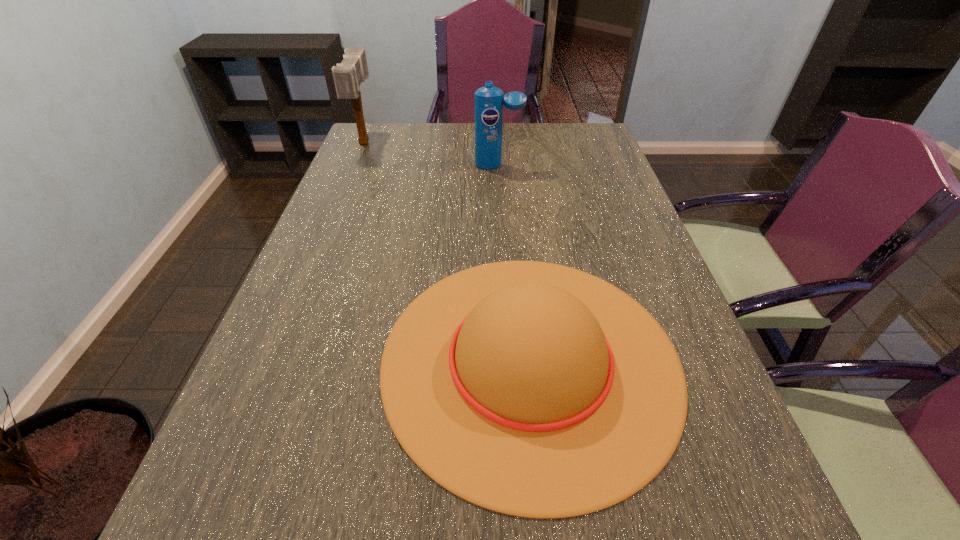
Locate an element on the screen. The height and width of the screenshot is (540, 960). object at the right edge is located at coordinates (532, 389).

Locate an element on the screen. object that is at the far left corner is located at coordinates (348, 75).

Identify the location of blank space at the left edge of the desktop. (277, 320).

What are the coordinates of `free space at the right edge of the desktop` in the screenshot? It's located at (717, 467).

Where is `vacant point at the far left corner`? vacant point at the far left corner is located at coordinates (397, 144).

This screenshot has width=960, height=540. Find the location of `vacant space at the far right corner`. vacant space at the far right corner is located at coordinates (564, 135).

The width and height of the screenshot is (960, 540). I want to click on vacant space in between the shampoo and the leftmost object, so click(x=431, y=154).

Locate an element on the screen. empty location between the shampoo and the farthest object is located at coordinates (431, 154).

The height and width of the screenshot is (540, 960). I want to click on free spot between the sombrero and the farthest object, so click(x=447, y=251).

The image size is (960, 540). What are the coordinates of `free point between the nearest object and the mallet` in the screenshot? It's located at (447, 251).